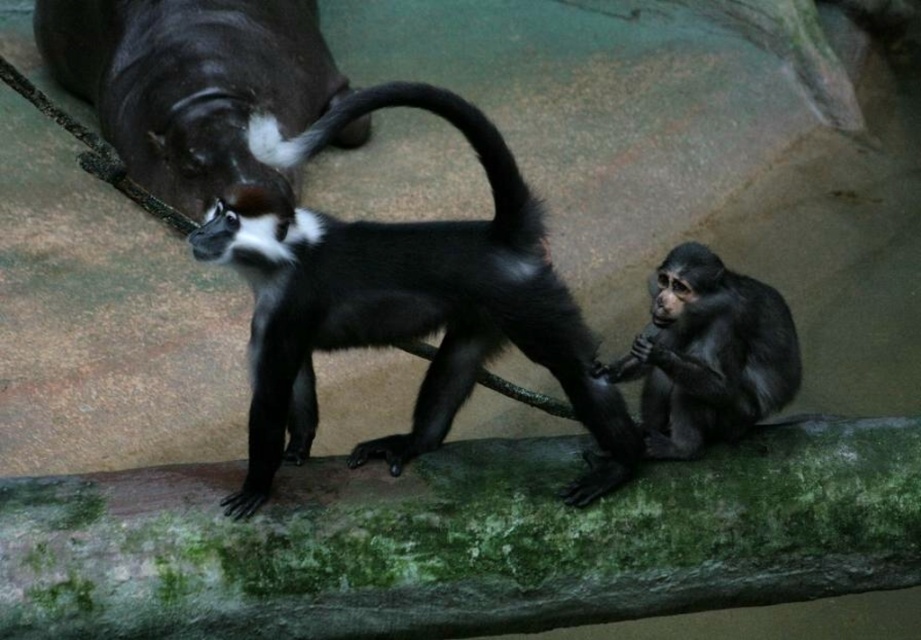
Question: Observing the image, what is the correct spatial positioning of black glossy monkey at center in reference to shiny black monkey at upper left?

Choices:
 (A) below
 (B) above

Answer: (A)

Question: Is black glossy monkey at center below shiny black monkey at upper left?

Choices:
 (A) yes
 (B) no

Answer: (A)

Question: Which of these objects is positioned farthest from the black glossy tail at center?

Choices:
 (A) shiny black monkey at center
 (B) shiny black monkey at upper left
 (C) black glossy monkey at center

Answer: (B)

Question: Which object is closer to the camera taking this photo?

Choices:
 (A) black glossy tail at center
 (B) shiny black monkey at center
 (C) black glossy monkey at center
 (D) shiny black monkey at upper left

Answer: (C)

Question: In this image, where is shiny black monkey at upper left located relative to black glossy tail at center?

Choices:
 (A) right
 (B) left

Answer: (B)

Question: Among these points, which one is nearest to the camera?

Choices:
 (A) click(607, 394)
 (B) click(218, 102)
 (C) click(502, 161)
 (D) click(659, 346)

Answer: (C)